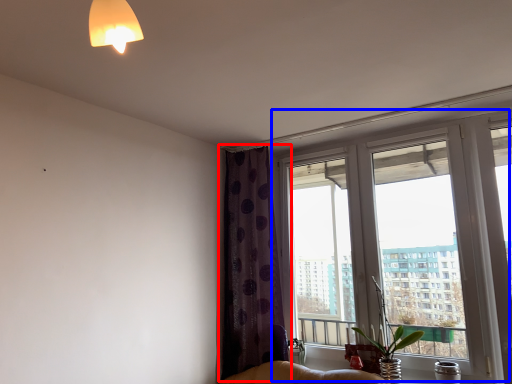
Question: Among these objects, which one is nearest to the camera, curtain (highlighted by a red box) or window (highlighted by a blue box)?

Choices:
 (A) curtain
 (B) window

Answer: (B)